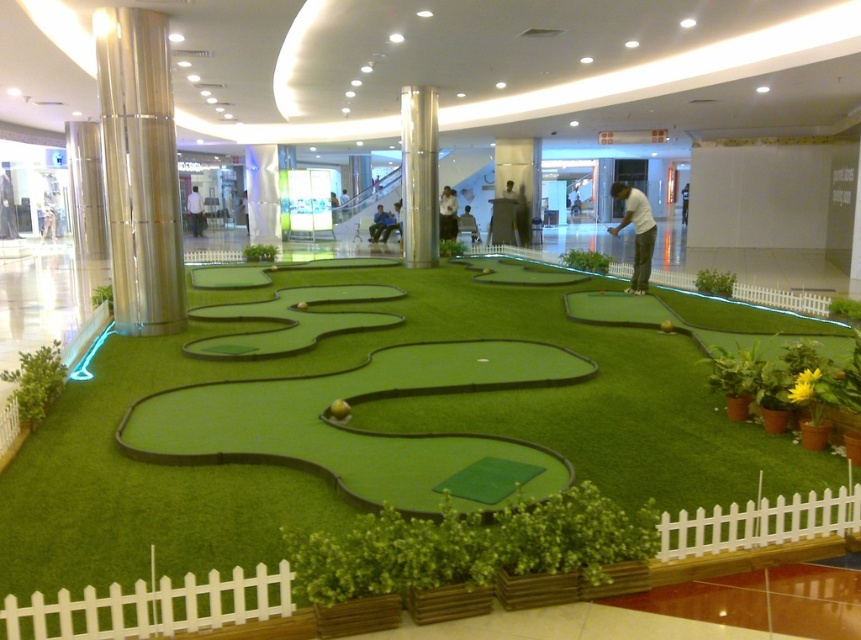
Question: Which object is closer to the camera taking this photo?

Choices:
 (A) silver metallic pillar at left
 (B) metallic silver pillar at center

Answer: (A)

Question: Where is silver metallic pillar at left located in relation to metallic silver pillar at center in the image?

Choices:
 (A) right
 (B) left

Answer: (B)

Question: Observing the image, what is the correct spatial positioning of silver metallic pillar at left in reference to white matte golf club at center?

Choices:
 (A) right
 (B) left

Answer: (B)

Question: Can you confirm if metallic silver pillar at center is positioned to the left of white matte golf club at center?

Choices:
 (A) yes
 (B) no

Answer: (A)

Question: Which of the following is the farthest from the observer?

Choices:
 (A) metallic silver pillar at center
 (B) silver metallic pillar at left

Answer: (A)

Question: Which point appears closest to the camera in this image?

Choices:
 (A) (643, 246)
 (B) (127, 148)

Answer: (B)